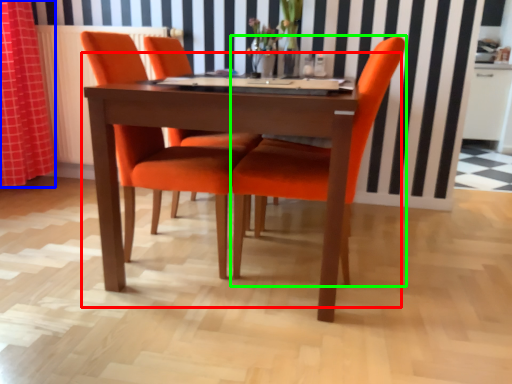
Question: Estimate the real-world distances between objects in this image. Which object is farther from kitchen & dining room table (highlighted by a red box), curtain (highlighted by a blue box) or chair (highlighted by a green box)?

Choices:
 (A) curtain
 (B) chair

Answer: (A)